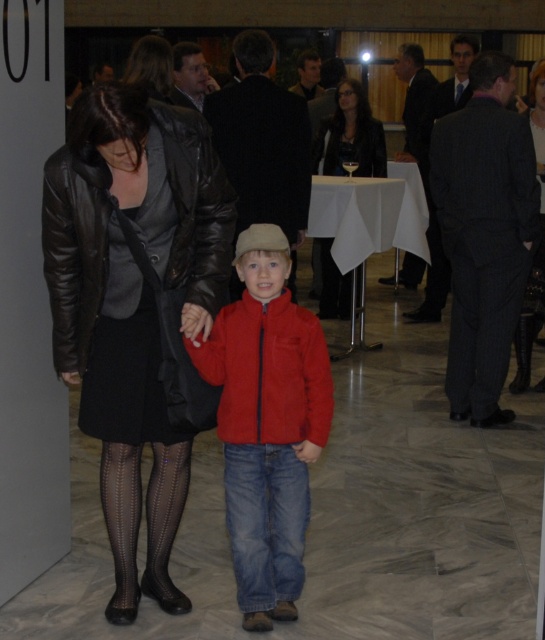
You are a photographer at the event and need to capture a photo that includes both the matte red jacket at center and the shiny black leather jacket at upper left. Your camera has a maximum focus range of 1.5 meters. Can you get both subjects in focus without moving the camera?

The matte red jacket at center is 1.25 meters away from the shiny black leather jacket at upper left. Since the distance between them is within the camera maximum focus range of 1.5 meters, the photographer can capture both subjects in focus without moving the camera.

You are at a formal event and want to take a photo of the shiny black leather jacket at upper left without including the matte red jacket at center in the frame. Is this possible given their positions?

The matte red jacket at center is closer to the viewer than the shiny black black leather jacket at upper left, so it would block the view of the shiny black leather jacket at upper left. Therefore, it is not possible to take a photo of the shiny black leather jacket at upper left without including the matte red jacket at center in the frame.